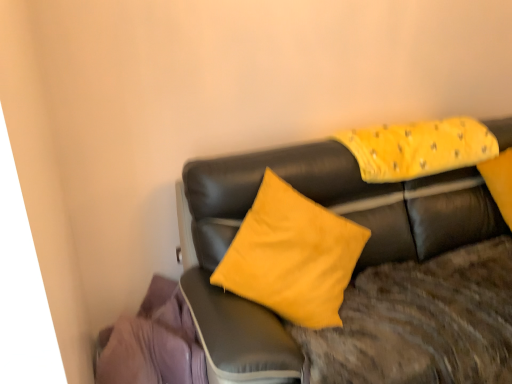
Question: Is matte black couch at center positioned behind yellow fabric pillow at upper right?

Choices:
 (A) yes
 (B) no

Answer: (B)

Question: Is yellow fabric pillow at upper right at the back of matte black couch at center?

Choices:
 (A) no
 (B) yes

Answer: (B)

Question: From a real-world perspective, is matte black couch at center over yellow fabric pillow at upper right?

Choices:
 (A) yes
 (B) no

Answer: (B)

Question: Considering the relative positions of matte black couch at center and yellow fabric pillow at upper right in the image provided, is matte black couch at center to the left of yellow fabric pillow at upper right from the viewer's perspective?

Choices:
 (A) no
 (B) yes

Answer: (A)

Question: Can you confirm if matte black couch at center is positioned to the right of yellow fabric pillow at upper right?

Choices:
 (A) no
 (B) yes

Answer: (B)

Question: Does matte black couch at center touch yellow fabric pillow at upper right?

Choices:
 (A) no
 (B) yes

Answer: (A)

Question: Considering the relative positions of yellow fabric pillow at upper right and matte black couch at center in the image provided, is yellow fabric pillow at upper right to the left of matte black couch at center from the viewer's perspective?

Choices:
 (A) no
 (B) yes

Answer: (B)

Question: From the image's perspective, is yellow fabric pillow at upper right located above matte black couch at center?

Choices:
 (A) no
 (B) yes

Answer: (B)

Question: Is yellow fabric pillow at upper right turned away from matte black couch at center?

Choices:
 (A) no
 (B) yes

Answer: (B)

Question: Can you confirm if yellow fabric pillow at upper right is bigger than matte black couch at center?

Choices:
 (A) yes
 (B) no

Answer: (B)

Question: Is yellow fabric pillow at upper right wider than matte black couch at center?

Choices:
 (A) no
 (B) yes

Answer: (A)

Question: Is yellow fabric pillow at upper right closer to the viewer compared to matte black couch at center?

Choices:
 (A) yes
 (B) no

Answer: (B)

Question: Is yellow fabric pillow at upper right behind purple fabric at lower left?

Choices:
 (A) yes
 (B) no

Answer: (A)